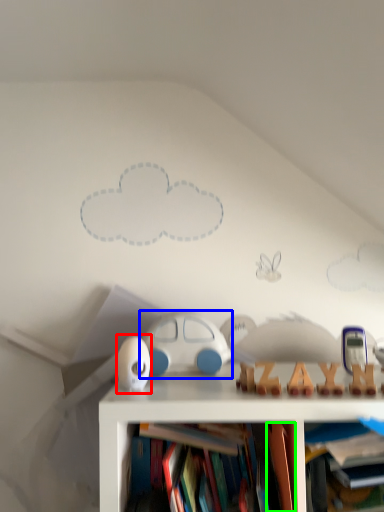
Question: Which is nearer to the toy (highlighted by a red box)? toy (highlighted by a blue box) or book (highlighted by a green box).

Choices:
 (A) toy
 (B) book

Answer: (A)